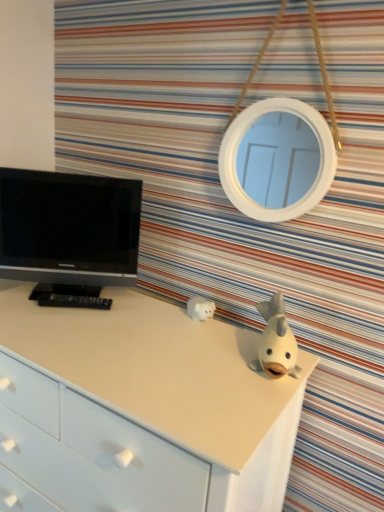
This screenshot has height=512, width=384. Find the location of `vacant space in between black glossy tv at left and white matte fish at upper right, arranged as the first toy when viewed from the front`. vacant space in between black glossy tv at left and white matte fish at upper right, arranged as the first toy when viewed from the front is located at coordinates (167, 331).